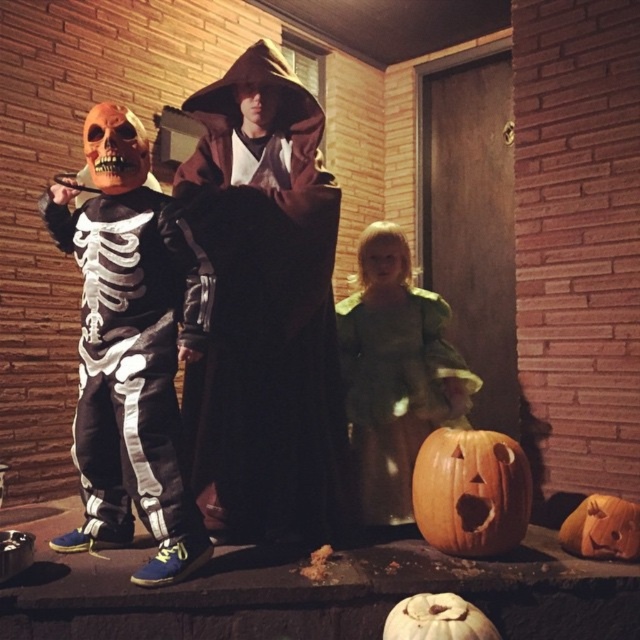
Question: Which object is closer to the camera taking this photo?

Choices:
 (A) white matte skeleton costume at left
 (B) orange matte pumpkin at lower center
 (C) brown velvet robe at center

Answer: (B)

Question: Is brown velvet robe at center behind carved wood pumpkin at lower center?

Choices:
 (A) no
 (B) yes

Answer: (A)

Question: Does green fabric dress at center appear on the left side of orange matte pumpkin at lower center?

Choices:
 (A) yes
 (B) no

Answer: (B)

Question: Does carved wood pumpkin at lower center appear under orange carved pumpkin at center?

Choices:
 (A) no
 (B) yes

Answer: (A)

Question: Which of the following is the closest to the observer?

Choices:
 (A) (449, 468)
 (B) (140, 513)
 (C) (586, 536)

Answer: (B)

Question: Which of the following is the closest to the observer?

Choices:
 (A) (458, 552)
 (B) (577, 522)
 (C) (120, 259)

Answer: (C)